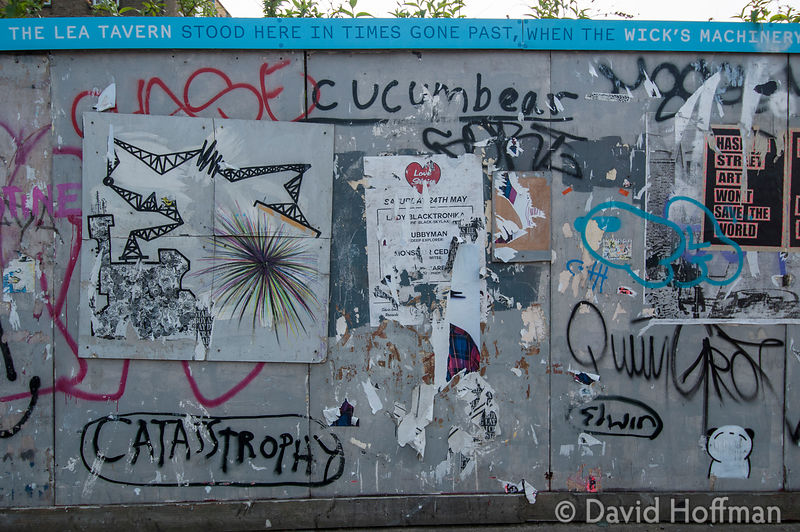
Find the location of a particular element. This screenshot has height=532, width=800. poster is located at coordinates (402, 196), (753, 182).